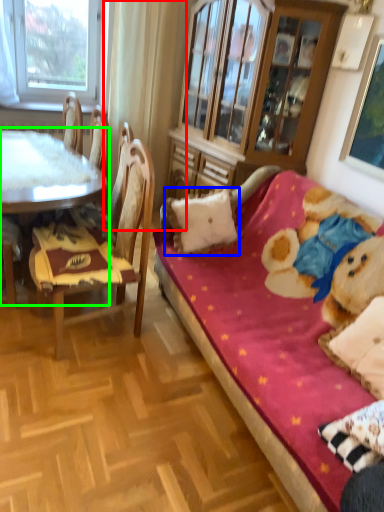
Question: Which object is the farthest from curtain (highlighted by a red box)? Choose among these: pillow (highlighted by a blue box) or table (highlighted by a green box).

Choices:
 (A) pillow
 (B) table

Answer: (A)